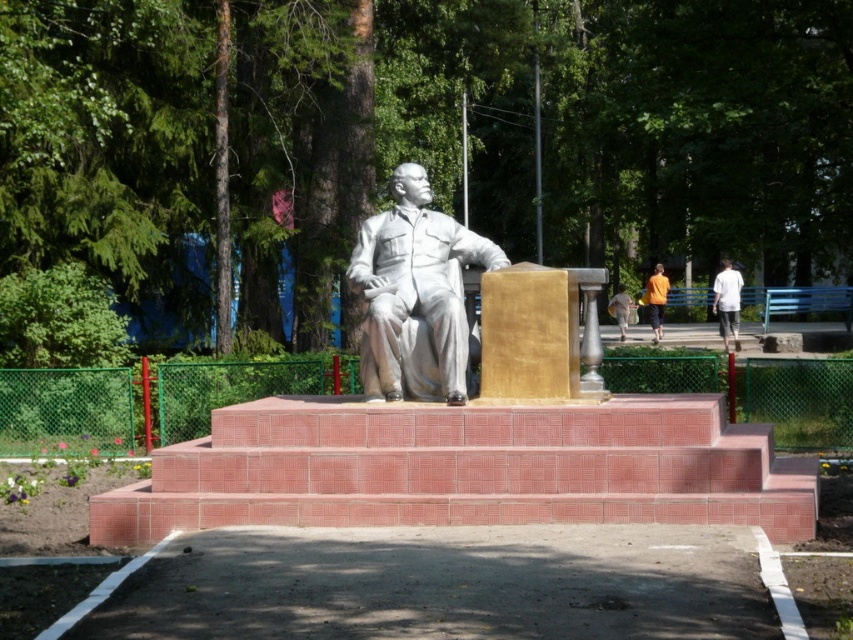
You are standing at the bottom of the red brick stairs at center in a park. You want to reach the white marble statue at center. Which direction should you move?

You should move upward towards the white marble statue at center since the red brick stairs at center is located below it.

You are standing in the park and want to take a photo of the statue. The camera you are using has a maximum focus range of 8 meters. Will you be able to focus on the statue from your current position at point [785,512]?

The distance between point [785,512] and the viewer is 8.36 meters. Since the camera can only focus up to 8 meters, you will not be able to focus on the statue from your current position.

In the scene shown: You are a photographer wanting to capture both the white cotton shirt at upper right and the yellow shirt at center in a single shot. Can you tell me which shirt is closer to the camera?

The white cotton shirt at upper right is positioned over the yellow shirt at center, meaning it is closer to the camera.